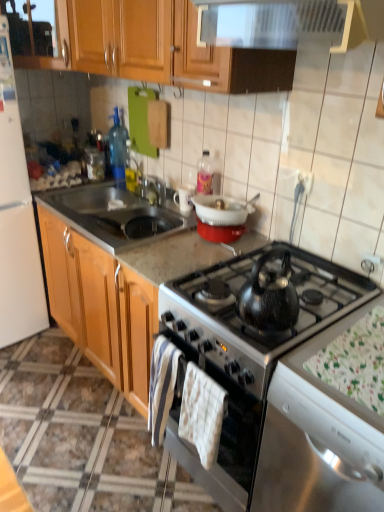
Question: Does white cotton hand towel at center, positioned as the 1th hand towel in right-to-left order, have a greater height compared to white matte refrigerator at left?

Choices:
 (A) no
 (B) yes

Answer: (A)

Question: From the image's perspective, is white cotton hand towel at center, which appears as the 2th hand towel when viewed from the left, under white matte refrigerator at left?

Choices:
 (A) no
 (B) yes

Answer: (B)

Question: Would you say white cotton hand towel at center, which appears as the 2th hand towel when viewed from the left, is outside white matte refrigerator at left?

Choices:
 (A) no
 (B) yes

Answer: (B)

Question: Is white cotton hand towel at center, positioned as the 1th hand towel in right-to-left order, positioned before white matte refrigerator at left?

Choices:
 (A) no
 (B) yes

Answer: (B)

Question: Is white matte refrigerator at left completely or partially inside white cotton hand towel at center, which appears as the 2th hand towel when viewed from the left?

Choices:
 (A) no
 (B) yes

Answer: (A)

Question: Looking at the image, does white plastic bowl at upper center seem bigger or smaller compared to white matte refrigerator at left?

Choices:
 (A) small
 (B) big

Answer: (A)

Question: Is white plastic bowl at upper center in front of or behind white matte refrigerator at left in the image?

Choices:
 (A) front
 (B) behind

Answer: (B)

Question: From the image's perspective, is white plastic bowl at upper center positioned above or below white matte refrigerator at left?

Choices:
 (A) above
 (B) below

Answer: (B)

Question: Choose the correct answer: Is white plastic bowl at upper center inside white matte refrigerator at left or outside it?

Choices:
 (A) inside
 (B) outside

Answer: (B)

Question: Considering the positions of point (206, 197) and point (124, 215), is point (206, 197) closer or farther from the camera than point (124, 215)?

Choices:
 (A) closer
 (B) farther

Answer: (A)

Question: From their relative heights in the image, would you say white plastic bowl at upper center is taller or shorter than satin silver sink at center?

Choices:
 (A) tall
 (B) short

Answer: (B)

Question: Considering their positions, is white plastic bowl at upper center located in front of or behind satin silver sink at center?

Choices:
 (A) behind
 (B) front

Answer: (B)

Question: From a real-world perspective, is white plastic bowl at upper center positioned above or below satin silver sink at center?

Choices:
 (A) above
 (B) below

Answer: (A)

Question: Looking at the image, does white matte refrigerator at left seem bigger or smaller compared to white plastic bowl at upper center?

Choices:
 (A) small
 (B) big

Answer: (B)

Question: Is point (6, 281) closer or farther from the camera than point (210, 222)?

Choices:
 (A) farther
 (B) closer

Answer: (A)